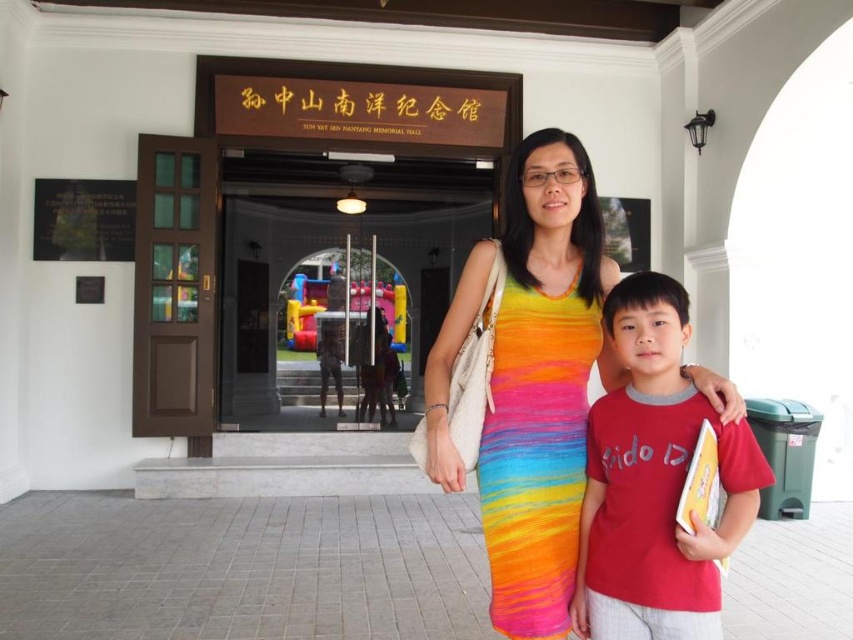
Question: Is glass door at center bigger than red cotton t-shirt at center?

Choices:
 (A) no
 (B) yes

Answer: (B)

Question: Which point is farther from the camera taking this photo?

Choices:
 (A) (335, 358)
 (B) (666, 330)

Answer: (A)

Question: Which point is closer to the camera?

Choices:
 (A) (502, 490)
 (B) (329, 253)

Answer: (A)

Question: Is rainbow knit dress at center to the right of red cotton t-shirt at center from the viewer's perspective?

Choices:
 (A) no
 (B) yes

Answer: (A)

Question: Observing the image, what is the correct spatial positioning of rainbow knit dress at center in reference to red cotton t-shirt at center?

Choices:
 (A) left
 (B) right

Answer: (A)

Question: Which object is the closest to the glass door at center?

Choices:
 (A) rainbow knit dress at center
 (B) red cotton t-shirt at center

Answer: (A)